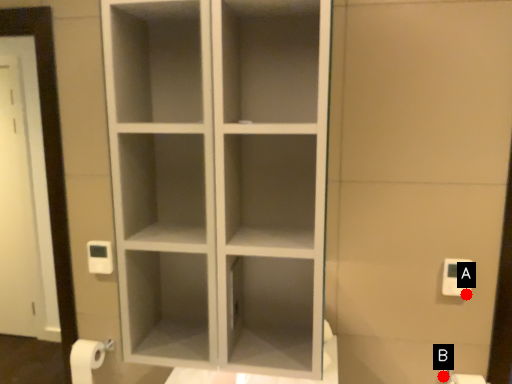
Question: Two points are circled on the image, labeled by A and B beside each circle. Which point is closer to the camera?

Choices:
 (A) A is closer
 (B) B is closer

Answer: (A)